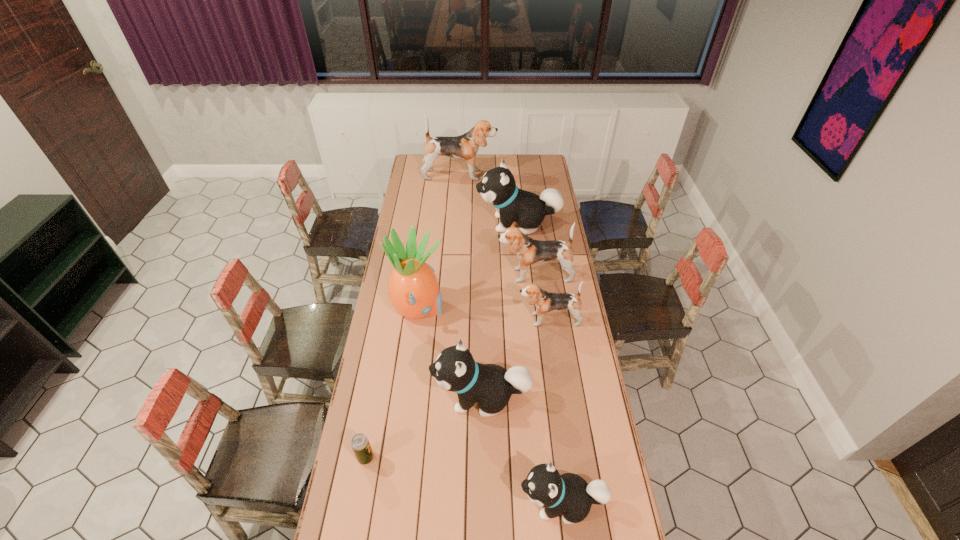
The height and width of the screenshot is (540, 960). Find the location of `vacant space located 0.140m at the face of the nearest white puppy`. vacant space located 0.140m at the face of the nearest white puppy is located at coordinates (473, 503).

The width and height of the screenshot is (960, 540). I want to click on free space located 0.370m at the face of the nearest white puppy, so pos(399,503).

Identify the location of blank space located 0.380m on the back of the beer can. This screenshot has width=960, height=540. (384, 356).

Locate an element on the screen. Image resolution: width=960 pixels, height=540 pixels. object at the far edge is located at coordinates (464, 147).

The height and width of the screenshot is (540, 960). In order to click on puppy at the left edge in this screenshot , I will do `click(464, 147)`.

The width and height of the screenshot is (960, 540). I want to click on pineapple located in the left edge section of the desktop, so click(413, 290).

This screenshot has height=540, width=960. In order to click on beer can at the left edge in this screenshot , I will do `click(360, 444)`.

Identify the location of object situated at the far left corner. (464, 147).

Where is `free space at the left edge`? free space at the left edge is located at coordinates (423, 220).

You are a GUI agent. You are given a task and a screenshot of the screen. Output one action in this format:
    pyautogui.click(x=<x>, y=<y>)
    Task: Click on the vacant space at the far right corner
    The height and width of the screenshot is (540, 960).
    Given the screenshot: What is the action you would take?
    pyautogui.click(x=533, y=167)